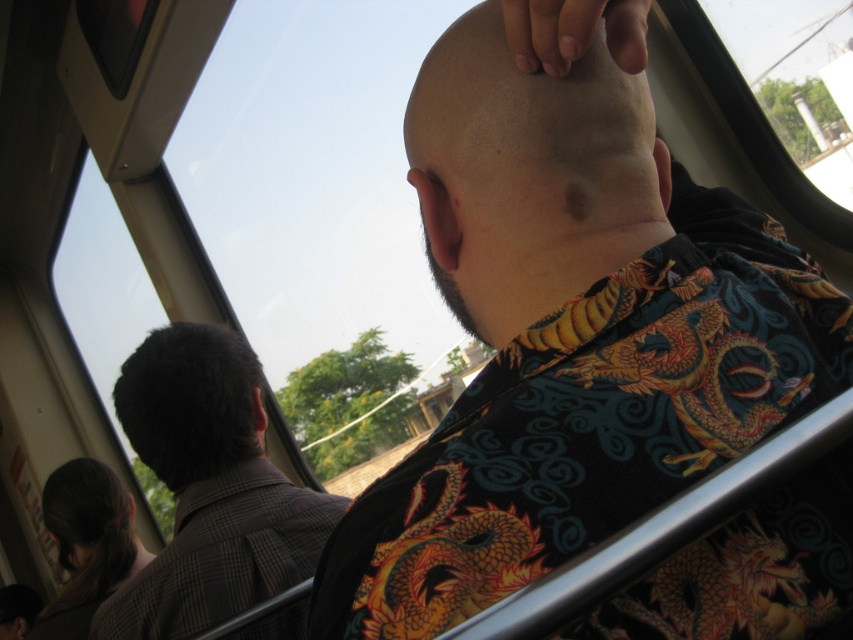
Question: Estimate the real-world distances between objects in this image. Which object is closer to the dark brown hair at left?

Choices:
 (A) brown checkered coat at left
 (B) smooth bald head at upper center
 (C) brown hair at lower left

Answer: (A)

Question: Is smooth bald head at upper center positioned before brown hair at lower left?

Choices:
 (A) no
 (B) yes

Answer: (B)

Question: Which point is closer to the camera?

Choices:
 (A) smooth bald head at upper center
 (B) brown checkered coat at left
 (C) dark brown hair at left
 (D) brown hair at lower left

Answer: (A)

Question: Observing the image, what is the correct spatial positioning of brown checkered coat at left in reference to brown hair at lower left?

Choices:
 (A) above
 (B) below

Answer: (A)

Question: Among these points, which one is nearest to the camera?

Choices:
 (A) (560, 33)
 (B) (123, 384)

Answer: (A)

Question: Can you confirm if brown checkered coat at left is positioned above dark brown hair at left?

Choices:
 (A) no
 (B) yes

Answer: (A)